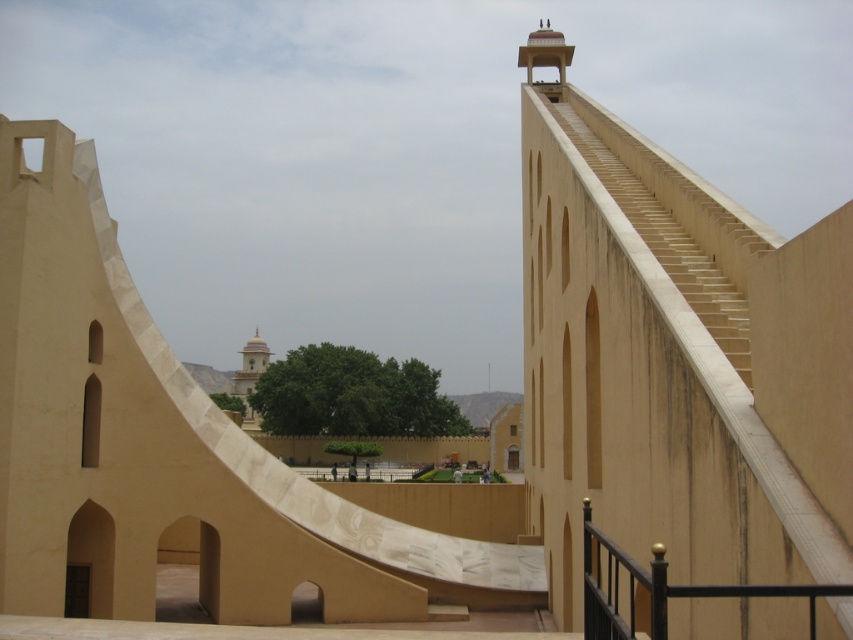
Question: Which object is closer to the camera taking this photo?

Choices:
 (A) smooth cream-colored dome at center
 (B) beige stone staircase at upper center
 (C) black metal railing at lower right

Answer: (C)

Question: Which of these objects is positioned closest to the beige stone staircase at upper center?

Choices:
 (A) black metal railing at lower right
 (B) smooth cream-colored dome at center

Answer: (A)

Question: Among these points, which one is nearest to the camera?

Choices:
 (A) (689, 588)
 (B) (666, 256)
 (C) (242, 378)

Answer: (A)

Question: Considering the relative positions of beige stone staircase at upper center and smooth cream-colored dome at center in the image provided, where is beige stone staircase at upper center located with respect to smooth cream-colored dome at center?

Choices:
 (A) right
 (B) left

Answer: (A)

Question: Considering the relative positions of black metal railing at lower right and smooth cream-colored dome at center in the image provided, where is black metal railing at lower right located with respect to smooth cream-colored dome at center?

Choices:
 (A) right
 (B) left

Answer: (A)

Question: Considering the relative positions of beige stone staircase at upper center and smooth cream-colored dome at center in the image provided, where is beige stone staircase at upper center located with respect to smooth cream-colored dome at center?

Choices:
 (A) right
 (B) left

Answer: (A)